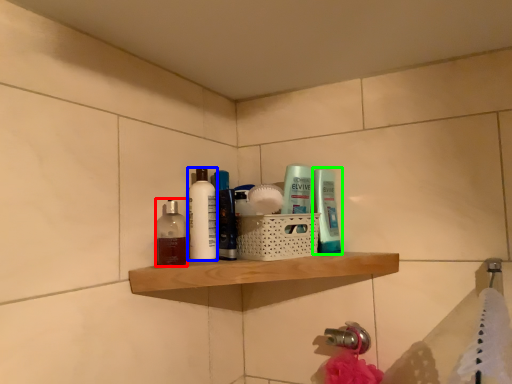
Question: Based on their relative distances, which object is nearer to mouthwash (highlighted by a red box)? Choose from toiletry (highlighted by a blue box) and toiletry (highlighted by a green box).

Choices:
 (A) toiletry
 (B) toiletry

Answer: (A)